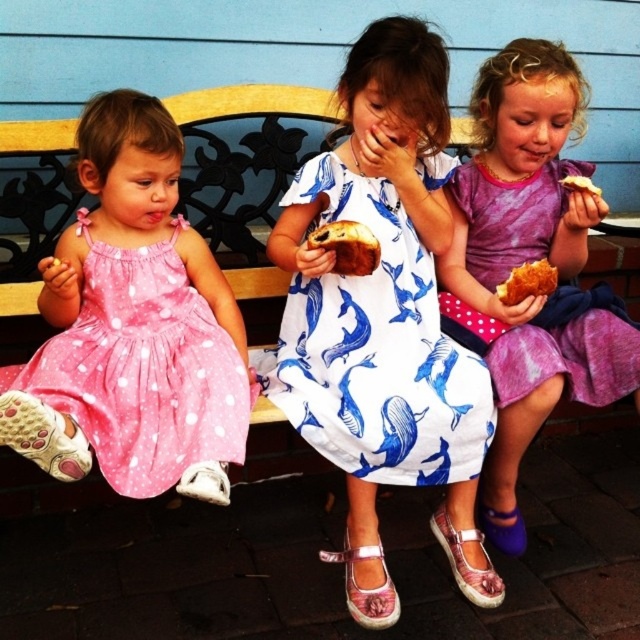
Who is more forward, (160,401) or (472,252)?

Point (160,401) is in front.

Between pink polka dot fabric dress at left and purple satin dress at right, which one appears on the left side from the viewer's perspective?

From the viewer's perspective, pink polka dot fabric dress at left appears more on the left side.

Is point (211, 476) positioned behind point (612, 362)?

That is False.

Image resolution: width=640 pixels, height=640 pixels. In order to click on pink polka dot fabric dress at left in this screenshot , I will do `click(132, 380)`.

Can you confirm if white matte dolphin dress at center is taller than golden brown bread at center?

Indeed, white matte dolphin dress at center has a greater height compared to golden brown bread at center.

Does white matte dolphin dress at center come in front of golden brown bread at center?

No, white matte dolphin dress at center is further to the viewer.

You are a GUI agent. You are given a task and a screenshot of the screen. Output one action in this format:
    pyautogui.click(x=<x>, y=<y>)
    Task: Click on the white matte dolphin dress at center
    The height and width of the screenshot is (640, 640).
    Given the screenshot: What is the action you would take?
    pyautogui.click(x=378, y=349)

Can you confirm if purple satin dress at center is bigger than purple satin dress at right?

Indeed, purple satin dress at center has a larger size compared to purple satin dress at right.

This screenshot has height=640, width=640. Describe the element at coordinates (529, 260) in the screenshot. I see `purple satin dress at center` at that location.

Is point (573, 323) positioned after point (522, 250)?

No, it is in front of (522, 250).

The height and width of the screenshot is (640, 640). I want to click on purple satin dress at center, so click(x=529, y=260).